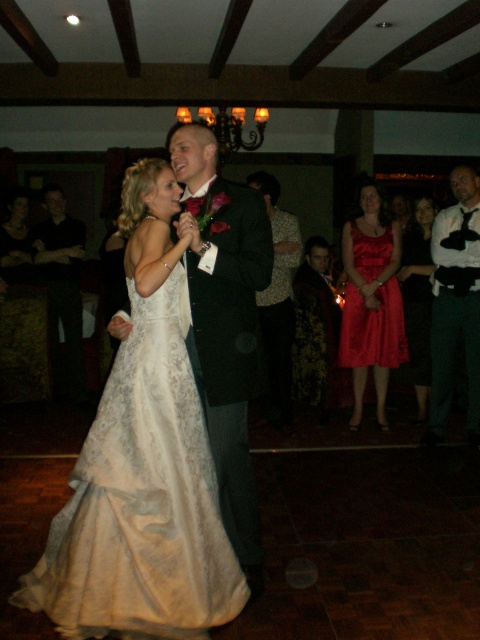
Does point (265, 212) come behind point (436, 380)?

No, it is not.

How distant is dark green suit at center from dark green textured suit at right?

dark green suit at center and dark green textured suit at right are 6.25 feet apart.

The image size is (480, 640). Describe the element at coordinates (226, 323) in the screenshot. I see `dark green suit at center` at that location.

Find the location of a particular element. dark green suit at center is located at coordinates (226, 323).

Is shiny red dress at center further to camera compared to shiny red dress at right?

No, it is in front of shiny red dress at right.

Does point (359, 349) come in front of point (422, 305)?

Yes.

Find the location of a particular element. Image resolution: width=480 pixels, height=640 pixels. shiny red dress at center is located at coordinates (372, 301).

Between lace dress at center and black smooth suit at left, which one appears on the left side from the viewer's perspective?

black smooth suit at left

In the scene shown: Which is above, lace dress at center or black smooth suit at left?

Positioned higher is black smooth suit at left.

Is point (96, 538) less distant than point (76, 384)?

Yes, it is.

Locate an element on the screen. The image size is (480, 640). lace dress at center is located at coordinates (143, 465).